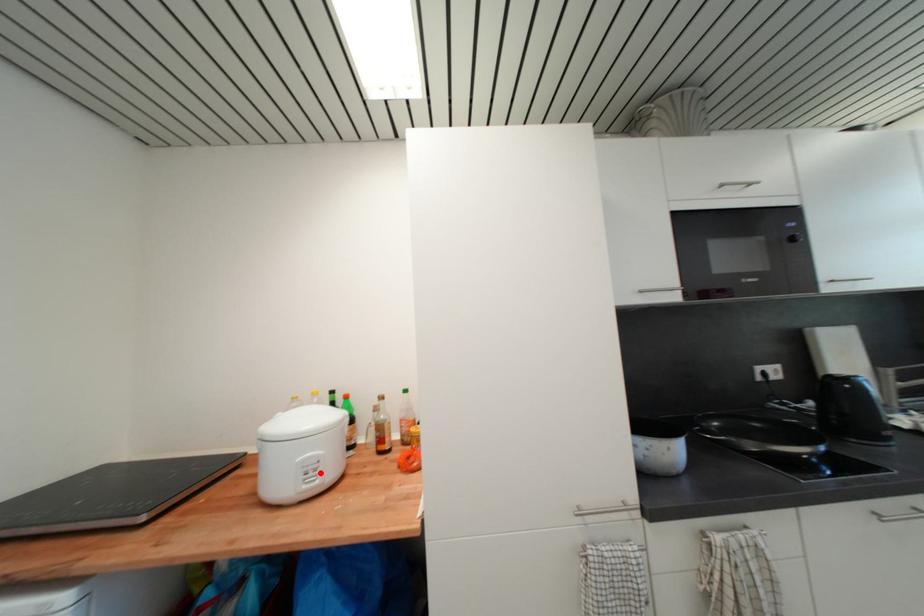
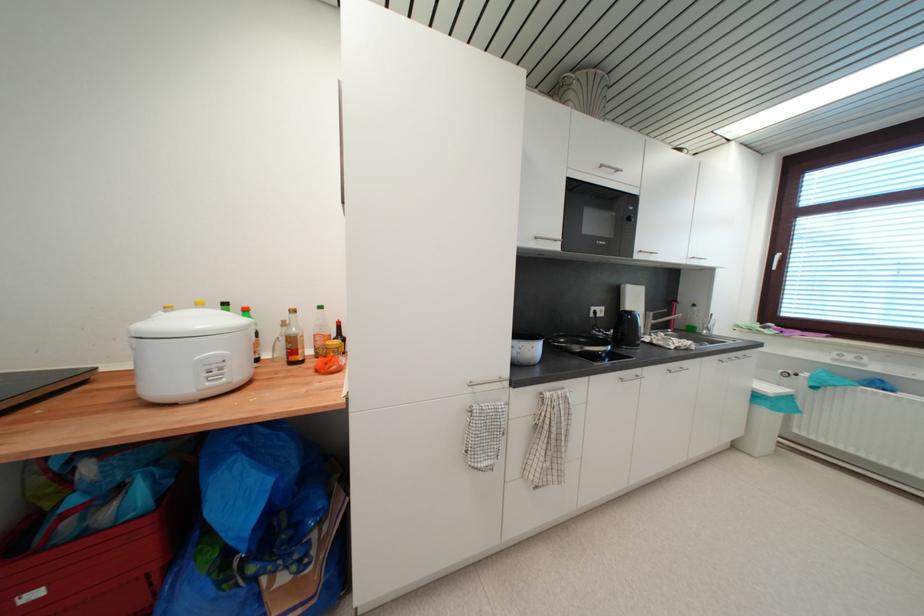
Locate, in the second image, the point that corresponds to the highlighted location in the first image.

(225, 371)